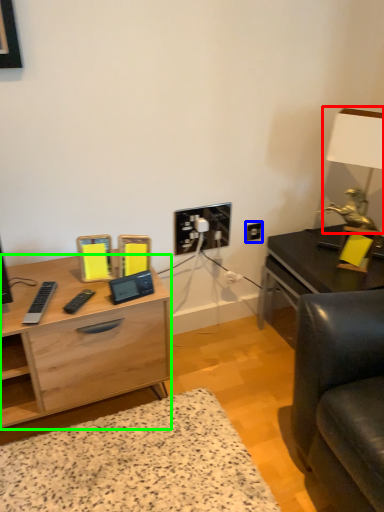
Question: Which object is positioned closest to table lamp (highlighted by a red box)? Select from electric outlet (highlighted by a blue box) and desk (highlighted by a green box).

Choices:
 (A) electric outlet
 (B) desk

Answer: (A)